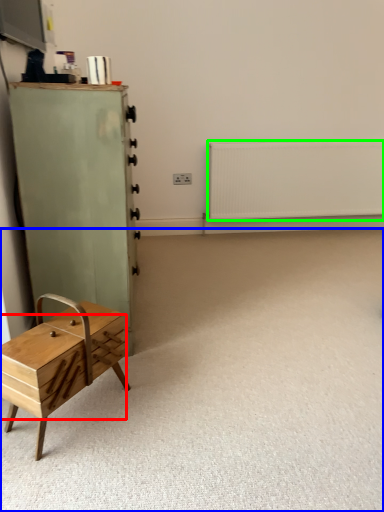
Question: Based on their relative distances, which object is farther from drawer (highlighted by a red box)? Choose from plain (highlighted by a blue box) and radiator (highlighted by a green box).

Choices:
 (A) plain
 (B) radiator

Answer: (B)